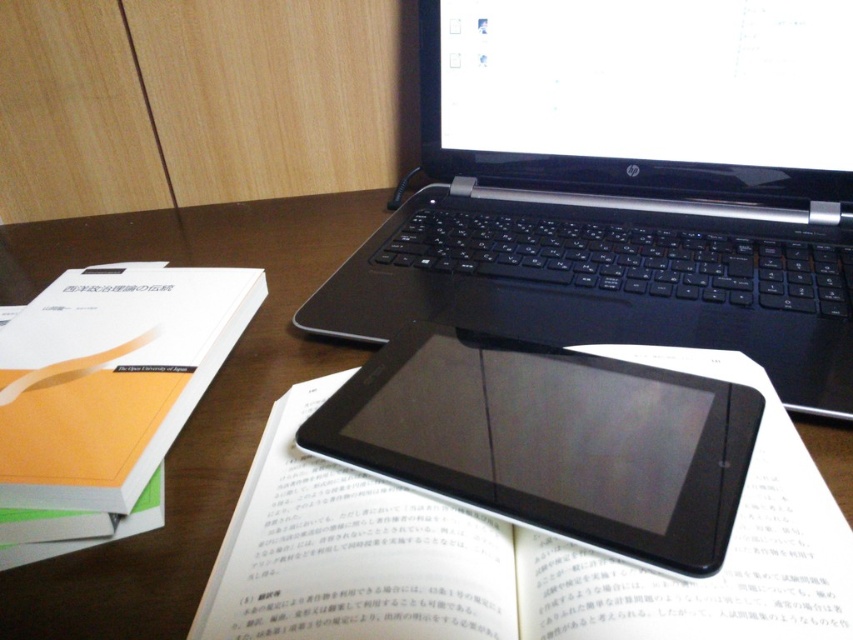
Between brown wooden table at center and white matte book at left, which one has less height?

Standing shorter between the two is white matte book at left.

Is brown wooden table at center thinner than white matte book at left?

No, brown wooden table at center is not thinner than white matte book at left.

Between point (283, 355) and point (15, 317), which one is positioned behind?

Positioned behind is point (15, 317).

You are a GUI agent. You are given a task and a screenshot of the screen. Output one action in this format:
    pyautogui.click(x=<x>, y=<y>)
    Task: Click on the brown wooden table at center
    
    Given the screenshot: What is the action you would take?
    pyautogui.click(x=195, y=406)

Does black plastic tablet at center have a lesser height compared to white matte book at left?

Yes.

Which is in front, point (733, 408) or point (33, 336)?

Point (733, 408) is in front.

Who is more forward, [659,481] or [131,456]?

Point [659,481] is more forward.

Find the location of a particular element. black plastic tablet at center is located at coordinates (550, 442).

Where is `black plastic laptop at upper center`? black plastic laptop at upper center is located at coordinates (625, 182).

Is black plastic laptop at upper center wider than brown wooden table at center?

Correct, the width of black plastic laptop at upper center exceeds that of brown wooden table at center.

Is point (822, 365) in front of point (273, 256)?

That is True.

You are a GUI agent. You are given a task and a screenshot of the screen. Output one action in this format:
    pyautogui.click(x=<x>, y=<y>)
    Task: Click on the black plastic laptop at upper center
    
    Given the screenshot: What is the action you would take?
    pyautogui.click(x=625, y=182)